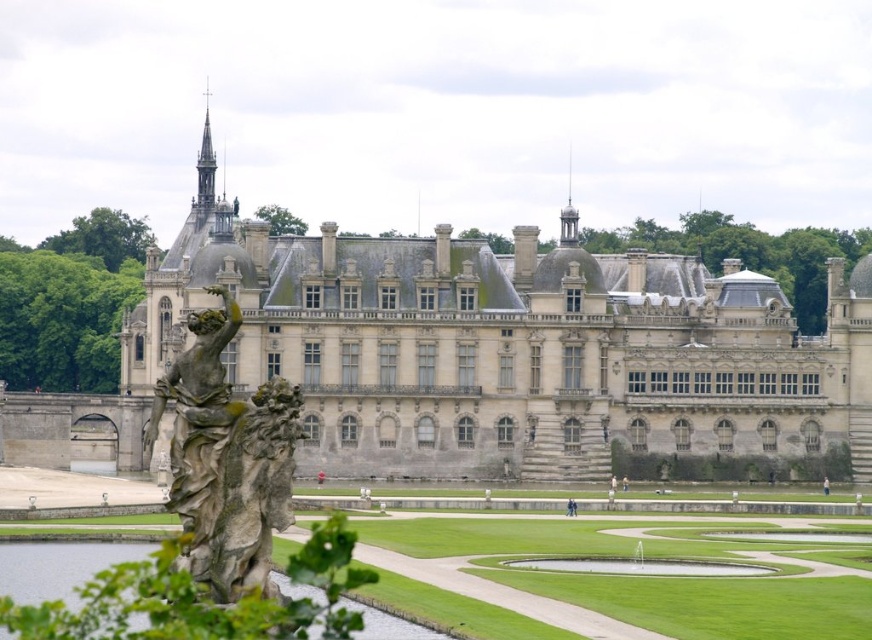
You are a tourist standing in front of the historic building. You want to take a photo that includes both the stone castle at center and the clear water at statue left. Which object should you position closer to the camera to ensure both are in focus?

The stone castle at center is much taller than the clear water at statue left, so positioning the stone castle at center closer to the camera will help keep both in focus since it is larger and more prominent.

You are standing in front of the stone castle at center and want to get to the clear water at statue left. Which direction should you move to reach it?

The clear water at statue left is behind the stone castle at center, so you should move backward to reach it.

You are an architect assessing the symmetry of the building. You notice the stone statue at left and the clear water at statue left. Which one has a smaller width?

The stone statue at left has a lesser width compared to the clear water at statue left.